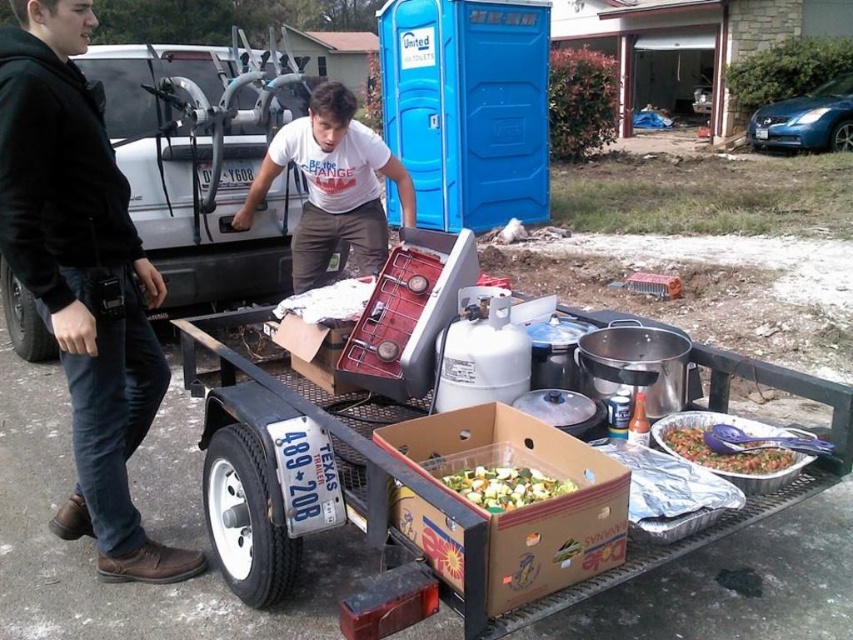
Question: Considering the real-world distances, which object is closest to the black cotton hoodie at left?

Choices:
 (A) white cardboard box at center
 (B) brown cardboard box at center
 (C) white cotton t-shirt at center
 (D) tomato salsa in aluminum pan at lower right

Answer: (A)

Question: Is white cotton t-shirt at center positioned before tomato salsa in aluminum pan at lower right?

Choices:
 (A) yes
 (B) no

Answer: (B)

Question: Which point is closer to the camera?

Choices:
 (A) brown cardboard box at center
 (B) tomato salsa in aluminum pan at lower right
 (C) white cardboard box at center

Answer: (A)

Question: Is brown cardboard box at center positioned behind green leafy vegetables at center?

Choices:
 (A) no
 (B) yes

Answer: (A)

Question: Is brown cardboard box at center to the right of green leafy vegetables at center from the viewer's perspective?

Choices:
 (A) no
 (B) yes

Answer: (A)

Question: Which object is positioned closest to the brown cardboard box at center?

Choices:
 (A) green leafy vegetables at center
 (B) black cotton hoodie at left

Answer: (A)